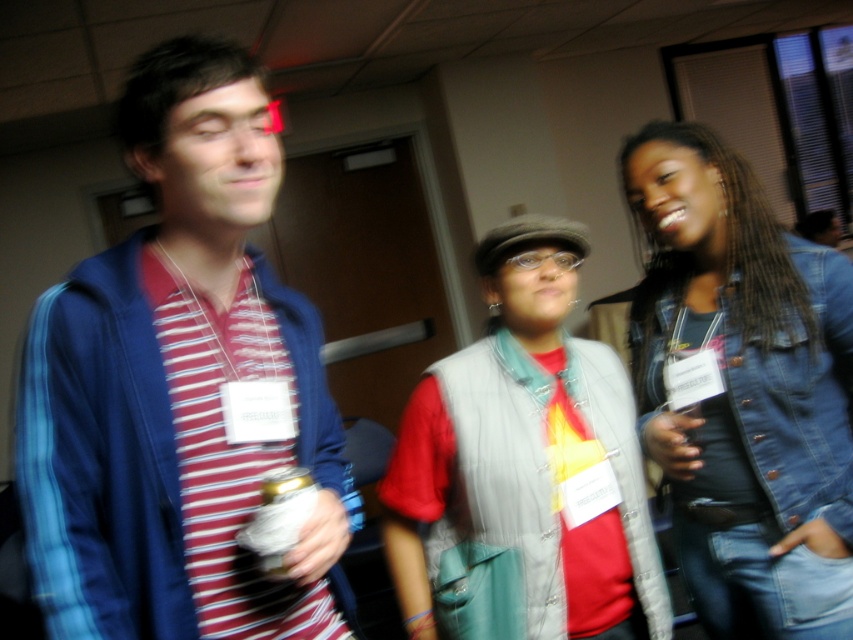
Question: Can you confirm if denim jacket at right is positioned to the left of gray fabric vest at center?

Choices:
 (A) no
 (B) yes

Answer: (A)

Question: From the image, what is the correct spatial relationship of blue striped shirt at left in relation to denim jacket at right?

Choices:
 (A) above
 (B) below

Answer: (A)

Question: Which of the following is the closest to the observer?

Choices:
 (A) (682, 147)
 (B) (256, 88)

Answer: (B)

Question: Which object is positioned farthest from the denim jacket at right?

Choices:
 (A) gray fabric vest at center
 (B) blue striped shirt at left

Answer: (B)

Question: Can you confirm if denim jacket at right is positioned to the right of gray fabric vest at center?

Choices:
 (A) yes
 (B) no

Answer: (A)

Question: Among these points, which one is farthest from the camera?

Choices:
 (A) (222, 60)
 (B) (480, 502)
 (C) (758, 204)

Answer: (C)